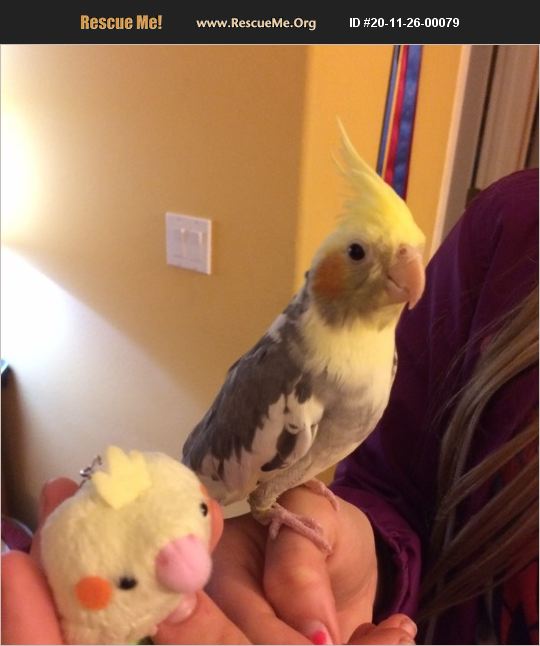
In order to click on corner in this screenshot , I will do `click(296, 214)`.